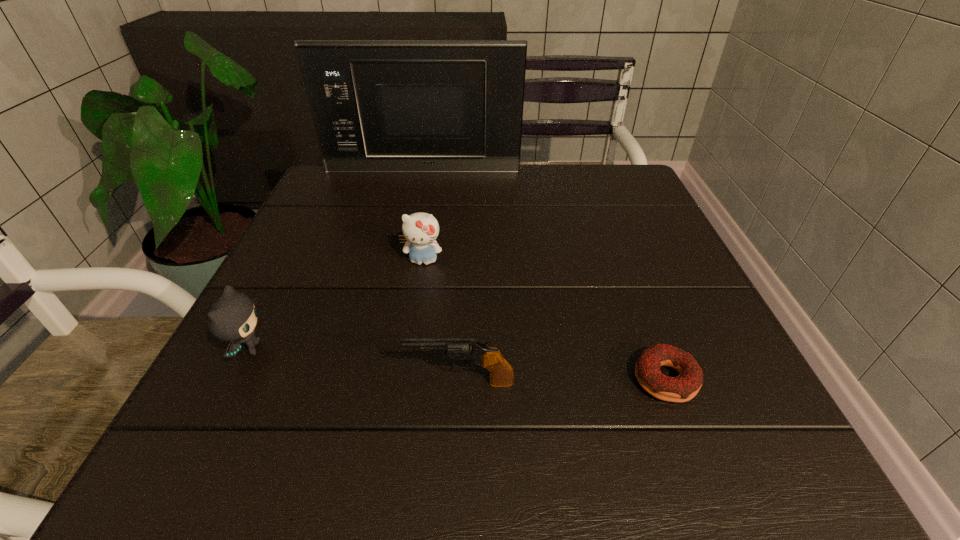
Where is `blank space located on the front-facing side of the left kitten`? blank space located on the front-facing side of the left kitten is located at coordinates (509, 349).

Locate an element on the screen. vacant space located 0.150m along the barrel of the gun is located at coordinates tap(307, 382).

Where is `free spot located 0.220m along the barrel of the gun`? The image size is (960, 540). free spot located 0.220m along the barrel of the gun is located at coordinates (261, 382).

This screenshot has width=960, height=540. In order to click on blank space located 0.280m along the barrel of the gun in this screenshot , I will do tap(221, 382).

Where is `vacant space situated on the left of the doughnut`? The width and height of the screenshot is (960, 540). vacant space situated on the left of the doughnut is located at coordinates (489, 380).

This screenshot has height=540, width=960. I want to click on object located at the far edge, so click(x=417, y=106).

Find the location of a particular element. The image size is (960, 540). microwave oven that is at the left edge is located at coordinates (417, 106).

Image resolution: width=960 pixels, height=540 pixels. In order to click on kitten at the left edge in this screenshot , I will do `click(232, 317)`.

Locate an element on the screen. object that is at the right edge is located at coordinates (682, 388).

You are a GUI agent. You are given a task and a screenshot of the screen. Output one action in this format:
    pyautogui.click(x=<x>, y=<y>)
    Task: Click on the object present at the far left corner
    Image resolution: width=960 pixels, height=540 pixels.
    Given the screenshot: What is the action you would take?
    click(417, 106)